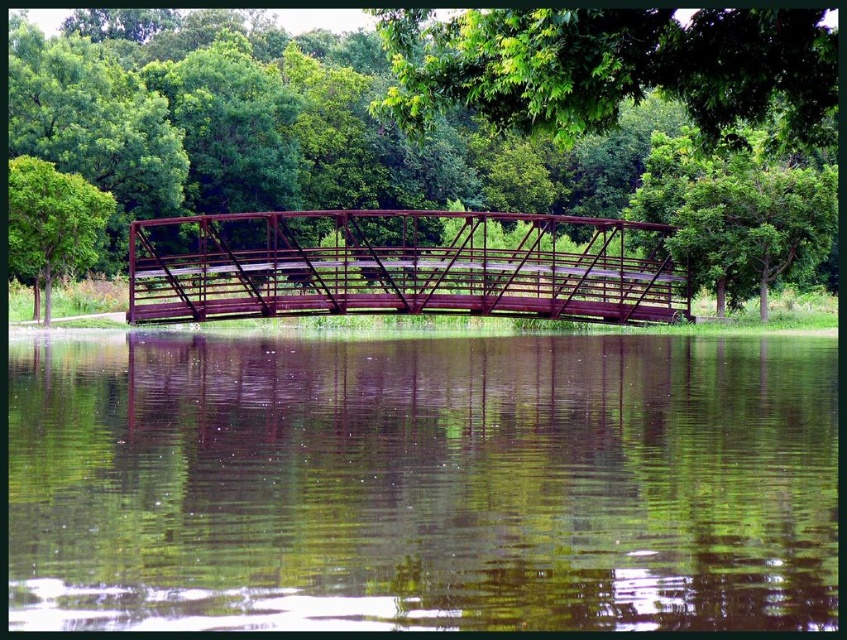
Who is shorter, green leafy tree at center or green leafy tree at left?

green leafy tree at left

Where is `green leafy tree at center`? The width and height of the screenshot is (847, 640). green leafy tree at center is located at coordinates [x=263, y=125].

Is point (214, 173) less distant than point (10, 228)?

No, (214, 173) is further to viewer.

Image resolution: width=847 pixels, height=640 pixels. What are the coordinates of `green leafy tree at center` in the screenshot? It's located at (263, 125).

Is point (170, 195) positioned behind point (439, 84)?

Yes, point (170, 195) is behind point (439, 84).

You are a GUI agent. You are given a task and a screenshot of the screen. Output one action in this format:
    pyautogui.click(x=<x>, y=<y>)
    Task: Click on the green leafy tree at center
    
    Given the screenshot: What is the action you would take?
    pyautogui.click(x=263, y=125)

Between point (801, 353) and point (313, 300), which one is positioned in front?

Positioned in front is point (801, 353).

Is point (757, 580) positioned in front of point (623, 291)?

Yes, point (757, 580) is in front of point (623, 291).

What do you see at coordinates (424, 483) in the screenshot?
I see `green reflective water at center` at bounding box center [424, 483].

The width and height of the screenshot is (847, 640). Find the location of `green reflective water at center`. green reflective water at center is located at coordinates (424, 483).